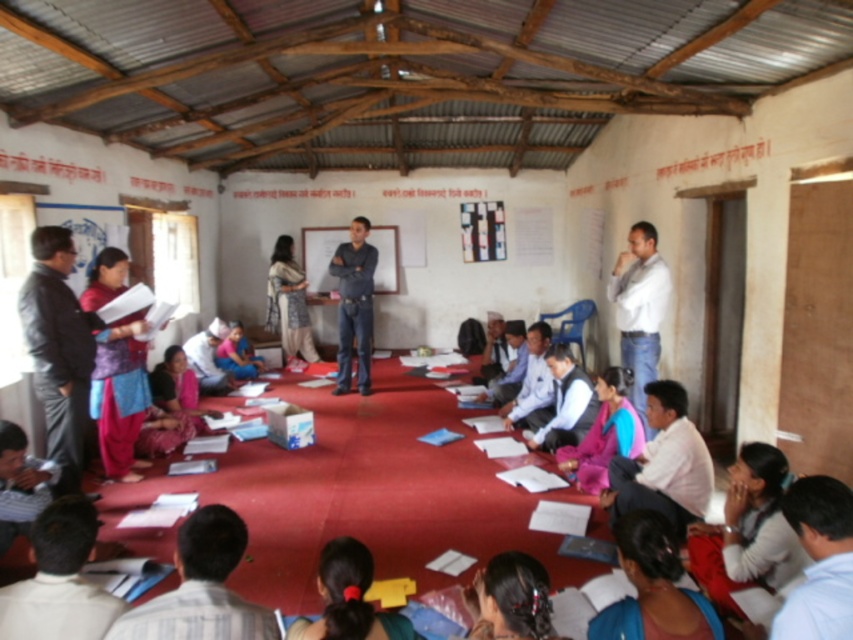
Question: Can you confirm if white shirt at upper right is positioned to the left of dark blue jeans at center?

Choices:
 (A) no
 (B) yes

Answer: (A)

Question: Among these points, which one is nearest to the camera?

Choices:
 (A) (624, 250)
 (B) (350, 304)

Answer: (A)

Question: Which of the following is the closest to the observer?

Choices:
 (A) (341, 307)
 (B) (643, 381)

Answer: (B)

Question: Can you confirm if white shirt at upper right is thinner than dark blue jeans at center?

Choices:
 (A) yes
 (B) no

Answer: (A)

Question: Can you confirm if white shirt at upper right is thinner than dark blue jeans at center?

Choices:
 (A) no
 (B) yes

Answer: (B)